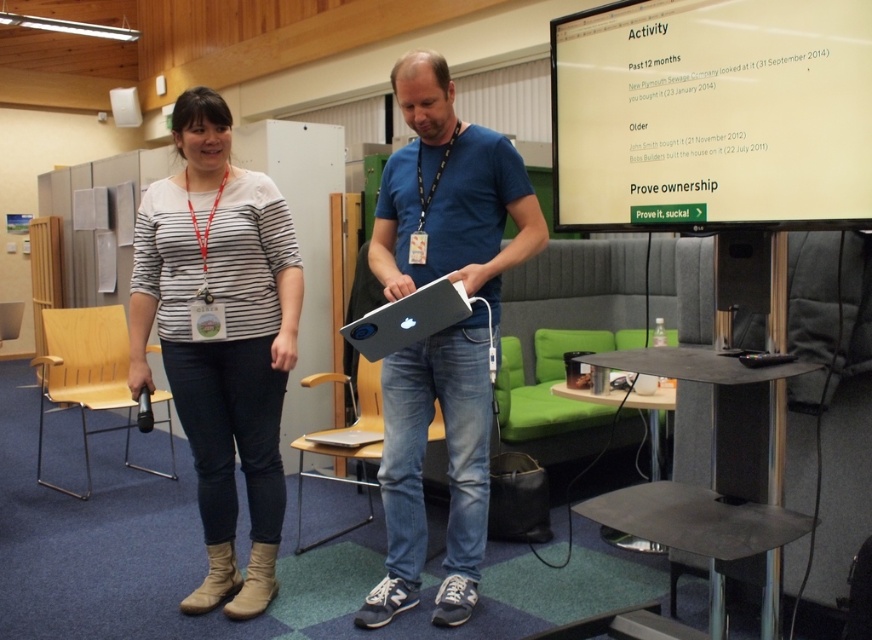
Question: Observing the image, what is the correct spatial positioning of matte striped shirt at center in reference to matte white laptop at center?

Choices:
 (A) right
 (B) left

Answer: (B)

Question: Is matte striped shirt at center further to the viewer compared to matte white laptop at center?

Choices:
 (A) no
 (B) yes

Answer: (B)

Question: Which object is the farthest from the matte white laptop at center?

Choices:
 (A) matte black laptop at center
 (B) matte striped shirt at center

Answer: (B)

Question: Which of the following is the closest to the observer?

Choices:
 (A) (387, 602)
 (B) (414, 141)

Answer: (A)

Question: Estimate the real-world distances between objects in this image. Which object is closer to the matte white laptop at center?

Choices:
 (A) matte black laptop at center
 (B) matte striped shirt at center

Answer: (A)

Question: Is matte black laptop at center wider than matte white laptop at center?

Choices:
 (A) no
 (B) yes

Answer: (B)